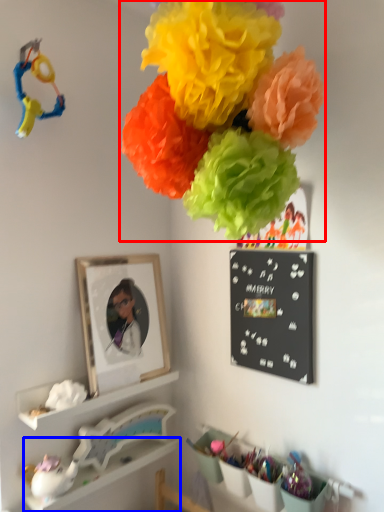
Question: Which object appears closest to the camera in this image, flower (highlighted by a red box) or shelf (highlighted by a blue box)?

Choices:
 (A) flower
 (B) shelf

Answer: (A)